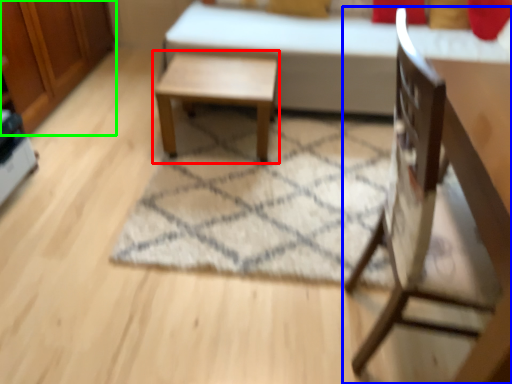
Question: Which object is the farthest from table (highlighted by a red box)? Choose among these: chair (highlighted by a blue box) or dresser (highlighted by a green box).

Choices:
 (A) chair
 (B) dresser

Answer: (A)